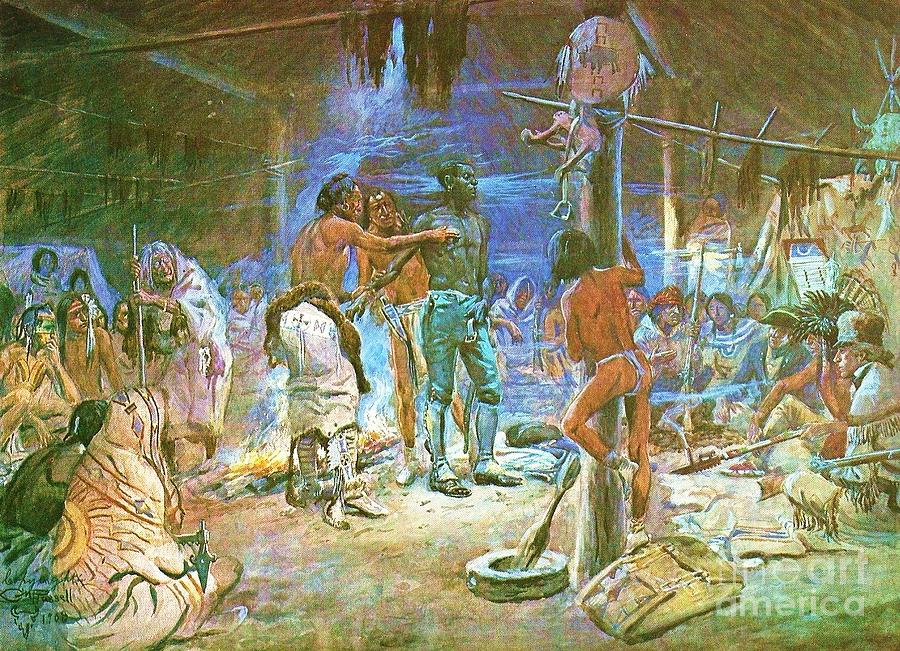
Find the location of `beams`. beams is located at coordinates (648, 30), (176, 62).